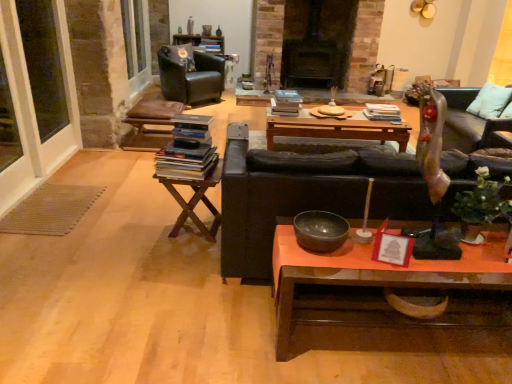
Locate an element on the screen. The height and width of the screenshot is (384, 512). vacant area in front of hardcover book at center, which is the third book from front to back is located at coordinates (377, 126).